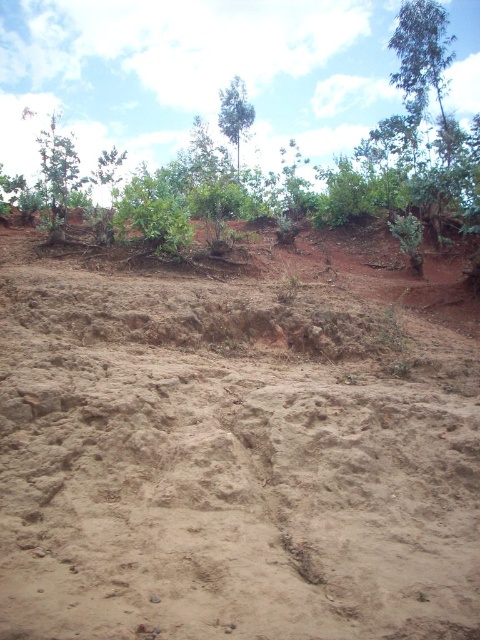
Can you confirm if brown sandy dirt field at center is taller than green leafy tree at upper right?

No.

Which is in front, point (395, 600) or point (441, 52)?

Positioned in front is point (395, 600).

Who is more distant from viewer, [259,474] or [444,141]?

Positioned behind is point [444,141].

This screenshot has width=480, height=640. Identify the location of brown sandy dirt field at center. (230, 458).

Is point (299, 444) in front of point (249, 124)?

Yes, point (299, 444) is in front of point (249, 124).

Locate an element on the screen. The image size is (480, 640). brown sandy dirt field at center is located at coordinates (230, 458).

Describe the element at coordinates (423, 58) in the screenshot. I see `green leafy tree at upper right` at that location.

Between point (445, 52) and point (223, 115), which one is positioned in front?

Point (445, 52) is more forward.

You are a GUI agent. You are given a task and a screenshot of the screen. Output one action in this format:
    pyautogui.click(x=<x>, y=<y>)
    Task: Click on the green leafy tree at upper right
    This screenshot has width=480, height=640.
    Given the screenshot: What is the action you would take?
    pyautogui.click(x=423, y=58)

This screenshot has width=480, height=640. In order to click on green leafy tree at upper right in this screenshot , I will do `click(423, 58)`.